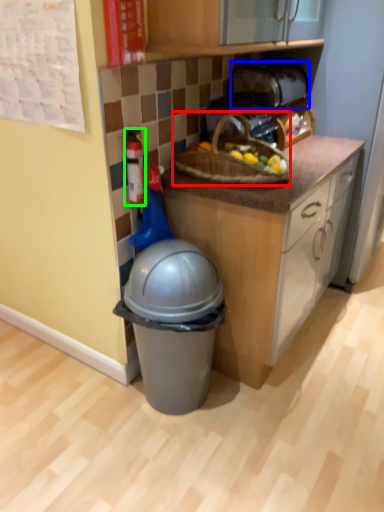
Question: Based on their relative distances, which object is farther from picnic basket (highlighted by a red box)? Choose from toaster (highlighted by a blue box) and toy (highlighted by a green box).

Choices:
 (A) toaster
 (B) toy

Answer: (A)